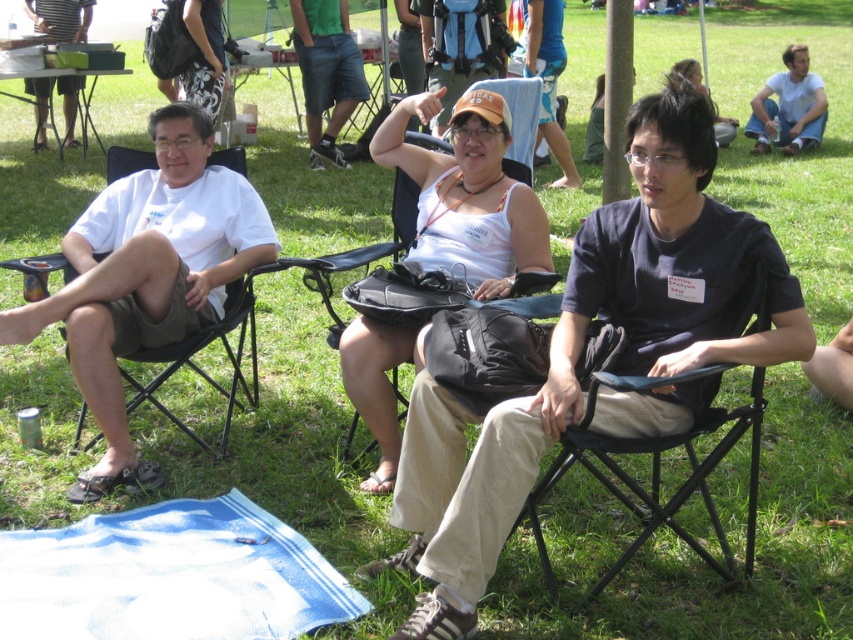
Is point (460, 516) positioned behind point (776, 108)?

No, it is in front of (776, 108).

Which is more to the left, dark blue t-shirt at center or white cotton shirt at upper right?

dark blue t-shirt at center

Locate an element on the screen. The height and width of the screenshot is (640, 853). dark blue t-shirt at center is located at coordinates (584, 349).

What do you see at coordinates (584, 349) in the screenshot? I see `dark blue t-shirt at center` at bounding box center [584, 349].

Is dark blue t-shirt at center thinner than black fabric chair at center?

In fact, dark blue t-shirt at center might be wider than black fabric chair at center.

In order to click on dark blue t-shirt at center in this screenshot , I will do `click(584, 349)`.

Looking at this image, between white cotton shirt at left and white fabric tank top at center, which one is positioned higher?

white fabric tank top at center is higher up.

Is white cotton shirt at left taller than white fabric tank top at center?

Yes, white cotton shirt at left is taller than white fabric tank top at center.

Does point (112, 289) lie in front of point (386, 401)?

Yes, it is.

This screenshot has height=640, width=853. I want to click on white cotton shirt at left, so click(x=148, y=276).